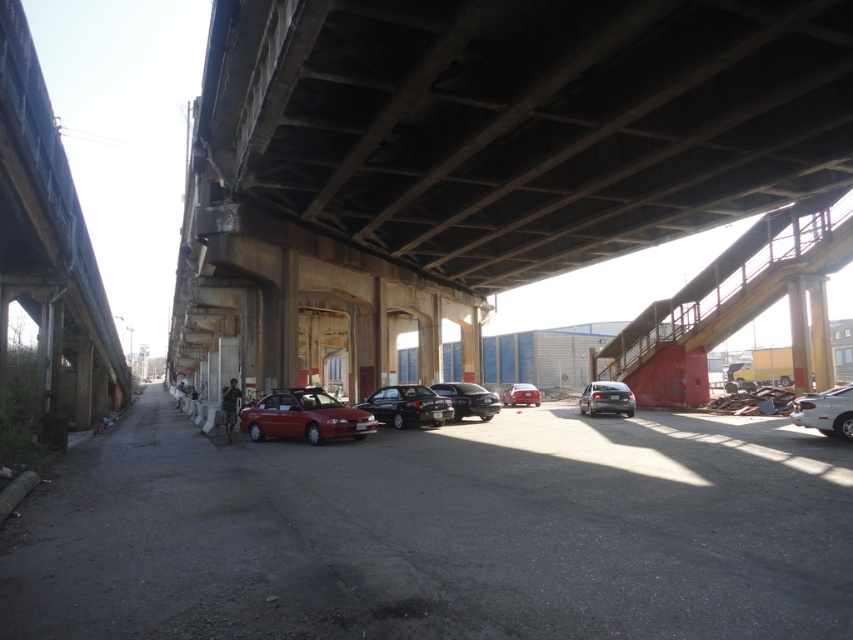
Question: Is white glossy sedan at right above glossy black sedan at center?

Choices:
 (A) no
 (B) yes

Answer: (B)

Question: Which point is farther to the camera?

Choices:
 (A) glossy black sedan at center
 (B) rusty metal overpass at upper center
 (C) shiny red car at center

Answer: (A)

Question: Which of these objects is positioned farthest from the glossy red car at center?

Choices:
 (A) rusty metal overpass at upper center
 (B) white glossy sedan at right
 (C) shiny black sedan at center

Answer: (B)

Question: Does shiny red car at center appear over satin black sedan at center-right?

Choices:
 (A) no
 (B) yes

Answer: (A)

Question: Can you confirm if shiny red car at center is positioned above rusty metal overpass at upper center?

Choices:
 (A) yes
 (B) no

Answer: (B)

Question: Considering the real-world distances, which object is closest to the rusty metal overpass at upper center?

Choices:
 (A) glossy red car at center
 (B) glossy black sedan at center

Answer: (B)